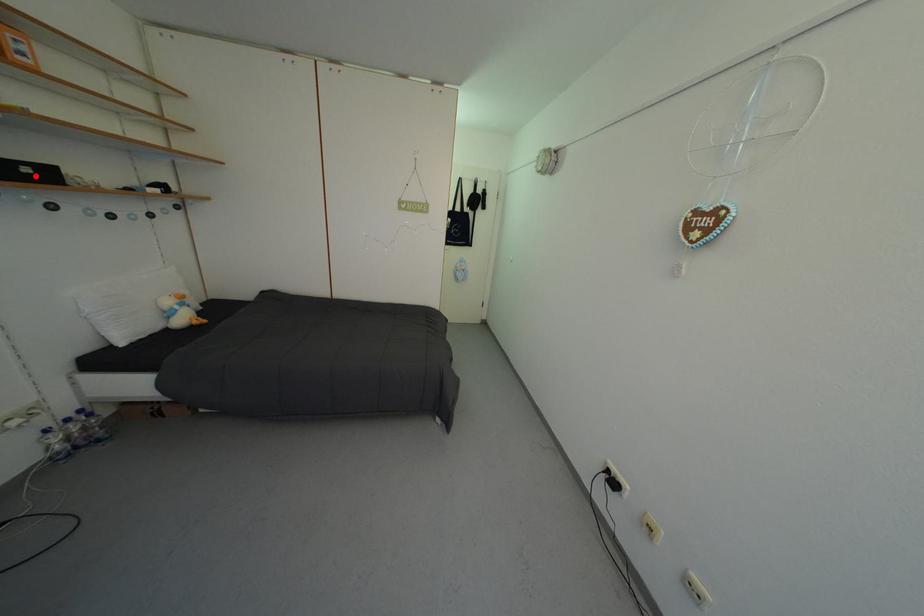
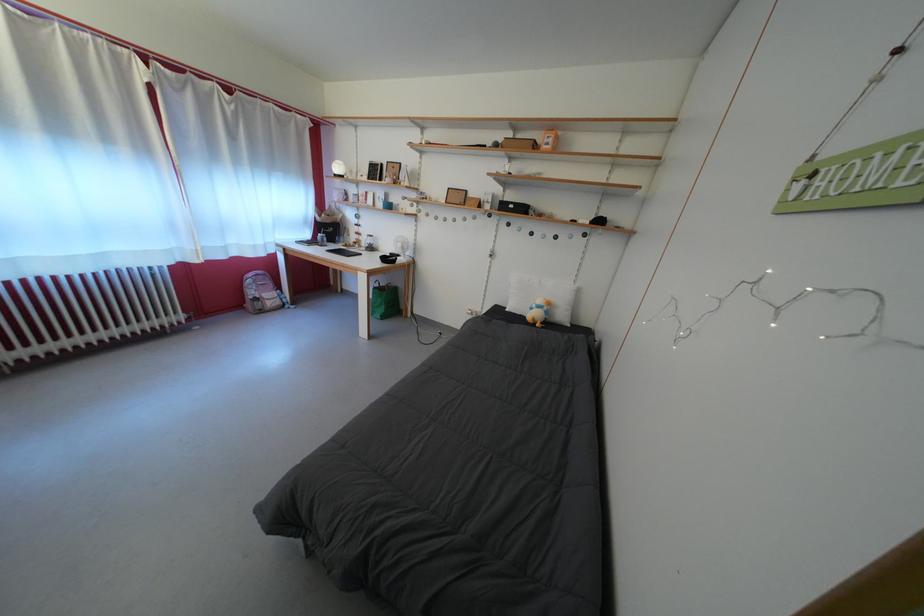
Question: I am providing you with two images of the same scene from different viewpoints. In image1, a red point is highlighted. Considering the same 3D point in image2, which of the following is correct?

Choices:
 (A) It is closer
 (B) It is farther

Answer: (A)